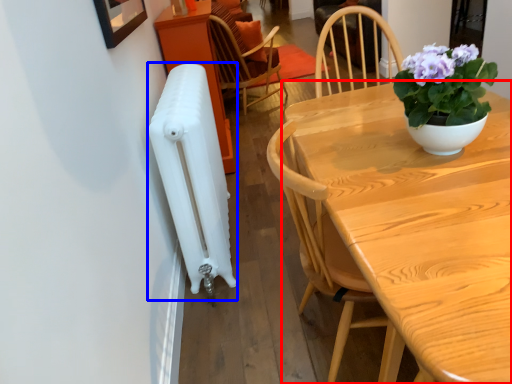
Question: Which of the following is the farthest to the observer, table (highlighted by a red box) or radiator (highlighted by a blue box)?

Choices:
 (A) table
 (B) radiator

Answer: (B)